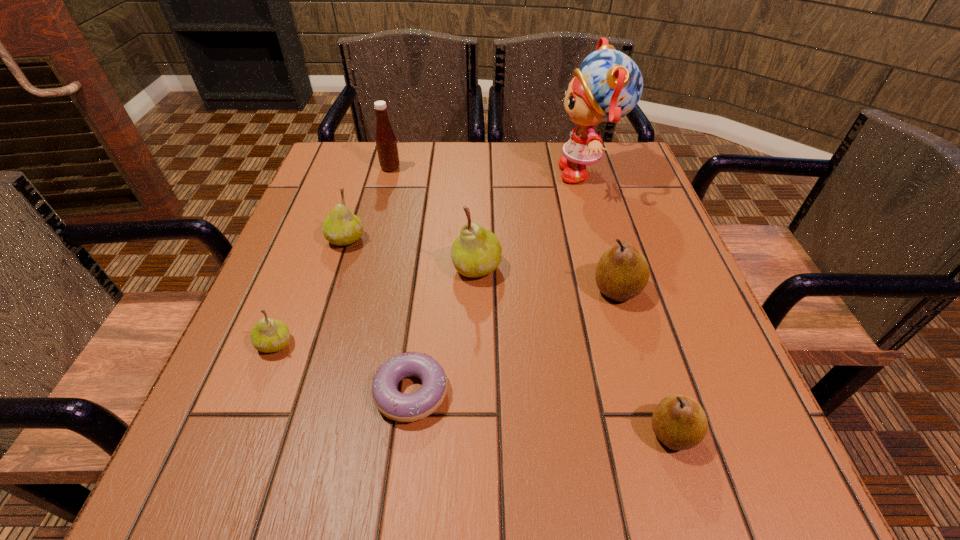
Locate an element on the screen. The image size is (960, 540). purple doughnut is located at coordinates pos(393,404).

Find the location of a particular element. doughnut is located at coordinates (393, 404).

Where is `vacant area situated 0.080m on the face of the doll`? vacant area situated 0.080m on the face of the doll is located at coordinates (523, 172).

Identify the location of vacant space located on the face of the doll. The width and height of the screenshot is (960, 540). (535, 172).

At what (x,y) coordinates should I click in order to perform the action: click on vacant space situated on the face of the doll. Please return your answer as a coordinate pair (x, y). Looking at the image, I should click on (535, 172).

Where is `free space located on the right of the white Tabasco sauce`? The image size is (960, 540). free space located on the right of the white Tabasco sauce is located at coordinates (509, 168).

I want to click on vacant space located on the left of the third pear from left to right, so click(393, 267).

Identify the location of free space located 0.080m on the left of the second biggest green pear. (290, 240).

Locate an element on the screen. Image resolution: width=960 pixels, height=540 pixels. vacant space positioned on the back of the farther brown pear is located at coordinates (595, 215).

The width and height of the screenshot is (960, 540). In order to click on vacant space located 0.330m on the back of the smallest green pear in this screenshot , I will do `click(325, 214)`.